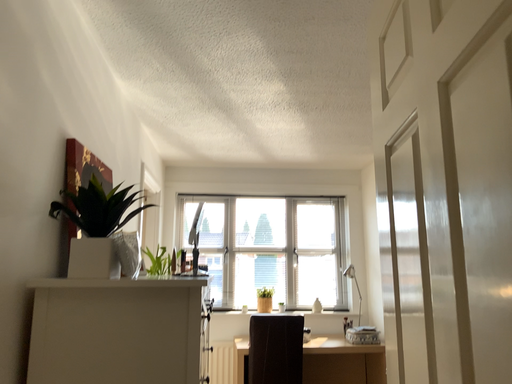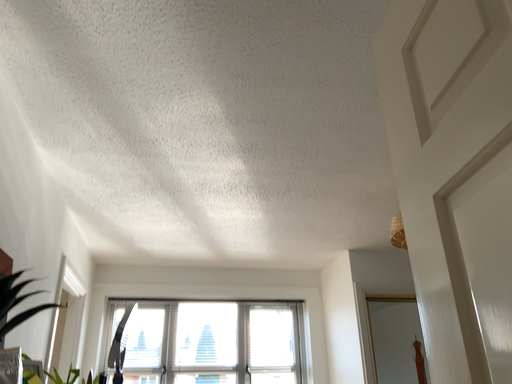
Question: Which way did the camera rotate in the video?

Choices:
 (A) rotated right
 (B) rotated left

Answer: (A)